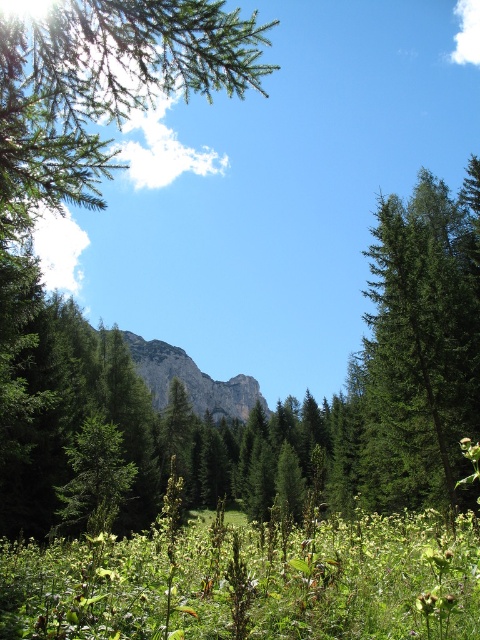
You are standing in the serene landscape described. There is a point marked at coordinates [103,88]. What object is located at this point?

The green needle like branches at upper left is located at point [103,88].